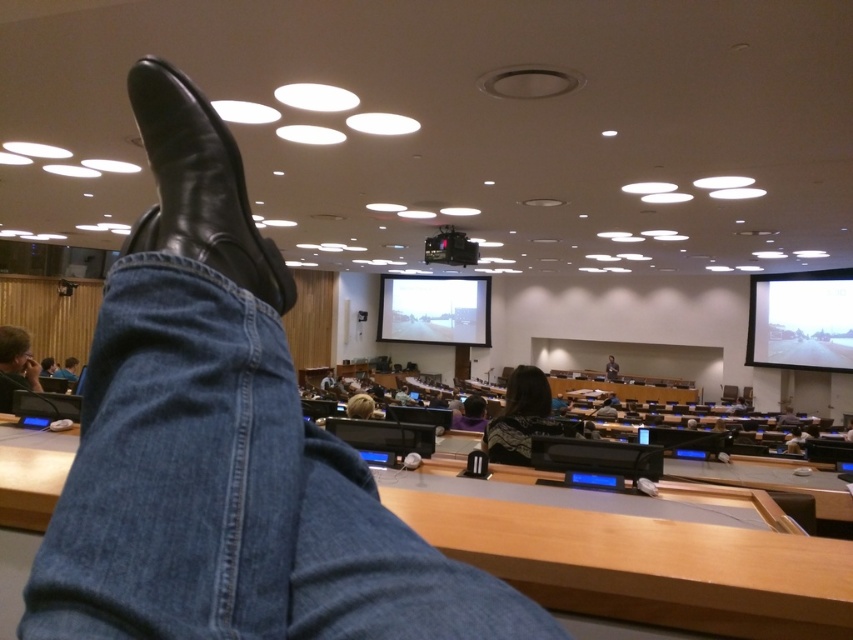
Question: Which point is closer to the camera?

Choices:
 (A) (41, 364)
 (B) (813, 285)

Answer: (A)

Question: Does black leather boot at upper center have a greater width compared to dark gray fabric jacket at lower center?

Choices:
 (A) no
 (B) yes

Answer: (A)

Question: Among these objects, which one is farthest from the camera?

Choices:
 (A) white matte projection screen at center
 (B) black plastic projector at upper center

Answer: (A)

Question: Is black plastic projector at upper center bigger than jeans at lower left?

Choices:
 (A) no
 (B) yes

Answer: (B)

Question: Based on their relative distances, which object is farther from the jeans at lower left?

Choices:
 (A) matte white screen at right
 (B) black plastic projector at upper center
 (C) white matte projection screen at center

Answer: (A)

Question: Is blonde hair at center wider than dark gray fabric jacket at lower center?

Choices:
 (A) yes
 (B) no

Answer: (B)